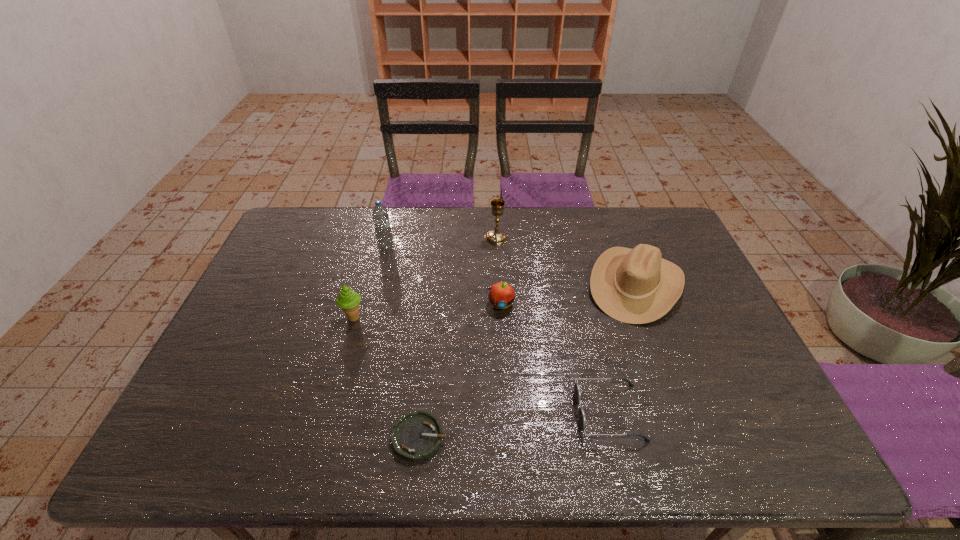
The height and width of the screenshot is (540, 960). I want to click on vacant space located on the right of the icecream, so click(x=437, y=318).

You are a GUI agent. You are given a task and a screenshot of the screen. Output one action in this format:
    pyautogui.click(x=<x>, y=<y>)
    Task: Click on the vacant point located 0.170m on the front of the cowboy hat
    
    Given the screenshot: What is the action you would take?
    pyautogui.click(x=669, y=378)

Where is `free space located on the left of the fifth tallest object`? This screenshot has height=540, width=960. free space located on the left of the fifth tallest object is located at coordinates (366, 304).

I want to click on free spot located 0.270m on the front-facing side of the sunglasses, so click(461, 413).

At what (x,y) coordinates should I click in order to perform the action: click on vacant area located 0.330m on the front-facing side of the sunglasses. Please return your answer as a coordinate pair (x, y). The image size is (960, 540). Looking at the image, I should click on (435, 413).

Locate an element on the screen. The image size is (960, 540). vacant space situated 0.370m on the front-facing side of the sunglasses is located at coordinates (418, 413).

The image size is (960, 540). In order to click on vacant space situated on the right of the third object from left to right in this screenshot , I will do `click(468, 437)`.

Where is `water bottle at the far edge`? water bottle at the far edge is located at coordinates (380, 216).

Find the location of `chalice at the far edge`. chalice at the far edge is located at coordinates (496, 236).

The width and height of the screenshot is (960, 540). Find the location of `sunglasses that is at the near edge`. sunglasses that is at the near edge is located at coordinates (577, 393).